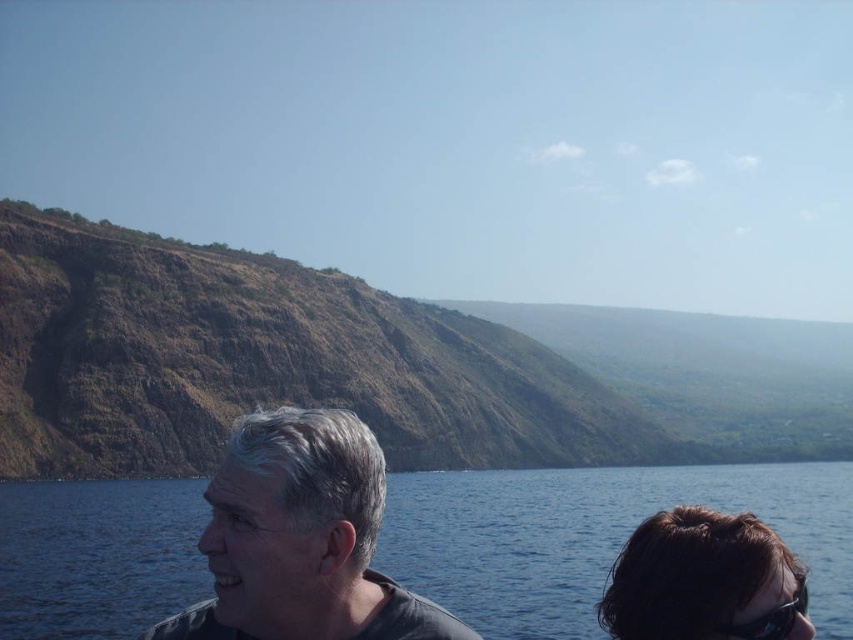
Question: Is brown hair at lower right further to the viewer compared to black plastic goggles at lower right?

Choices:
 (A) no
 (B) yes

Answer: (B)

Question: Which point is closer to the camera?

Choices:
 (A) gray matte hair at center
 (B) blue water at lower center

Answer: (A)

Question: Does blue water at lower center have a greater width compared to brown hair at lower right?

Choices:
 (A) no
 (B) yes

Answer: (B)

Question: Is blue water at lower center thinner than black plastic goggles at lower right?

Choices:
 (A) no
 (B) yes

Answer: (A)

Question: Which object appears closest to the camera in this image?

Choices:
 (A) black plastic goggles at lower right
 (B) blue water at lower center
 (C) gray matte hair at center

Answer: (C)

Question: Which point appears farthest from the camera in this image?

Choices:
 (A) (831, 492)
 (B) (772, 632)

Answer: (A)